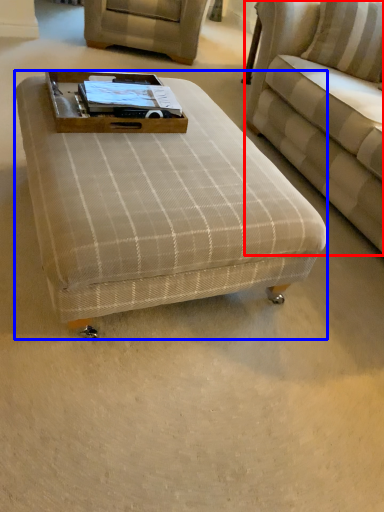
Question: Which object appears closest to the camera in this image, studio couch (highlighted by a red box) or table (highlighted by a blue box)?

Choices:
 (A) studio couch
 (B) table

Answer: (B)